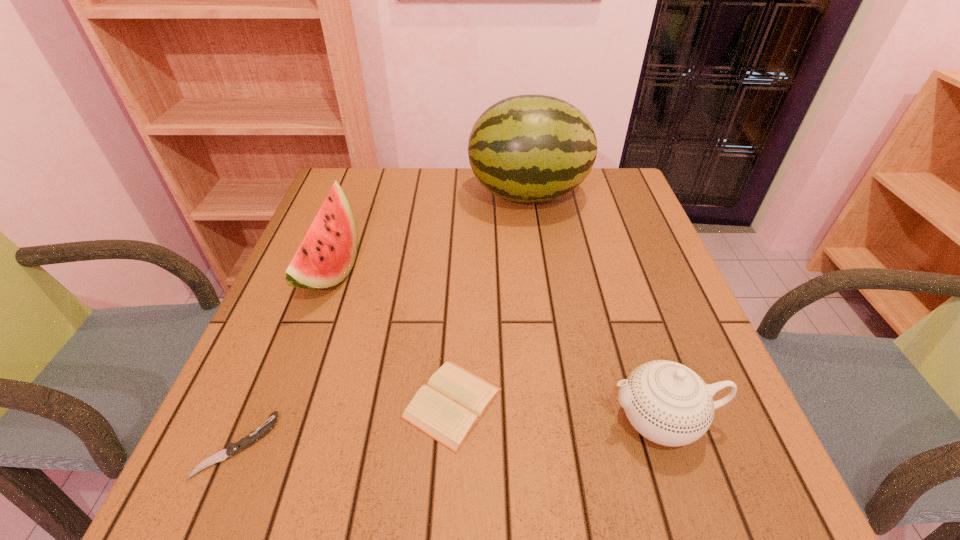
Identify the location of pocketknife present at the left edge. The height and width of the screenshot is (540, 960). (232, 449).

Where is `watermelon present at the right edge`? The height and width of the screenshot is (540, 960). watermelon present at the right edge is located at coordinates (528, 148).

Find the location of a particular element. chinaware that is at the right edge is located at coordinates (668, 403).

Locate an element on the screen. object that is at the near left corner is located at coordinates (232, 449).

Where is `object that is at the far right corner`? This screenshot has height=540, width=960. object that is at the far right corner is located at coordinates (528, 148).

In order to click on object located at the near right corner in this screenshot , I will do `click(668, 403)`.

At what (x,y) coordinates should I click in order to perform the action: click on free space at the far edge. Please return your answer as a coordinate pair (x, y). Looking at the image, I should click on [393, 175].

In order to click on vacant space at the near edge of the desktop in this screenshot , I will do `click(516, 468)`.

Where is `blank space at the left edge`? blank space at the left edge is located at coordinates (248, 366).

The image size is (960, 540). In order to click on vacant space at the right edge in this screenshot , I will do `click(744, 443)`.